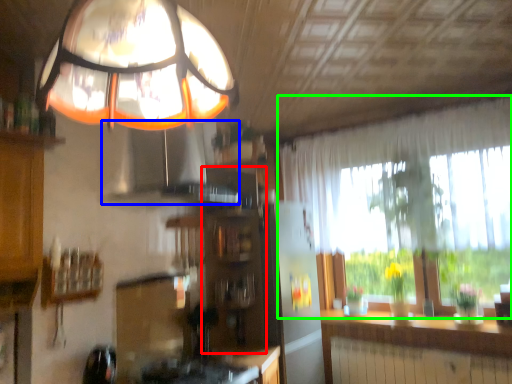
Question: Which object is positioned closest to cabinetry (highlighted by a red box)? Select from exhaust hood (highlighted by a blue box) and window (highlighted by a green box).

Choices:
 (A) exhaust hood
 (B) window

Answer: (A)